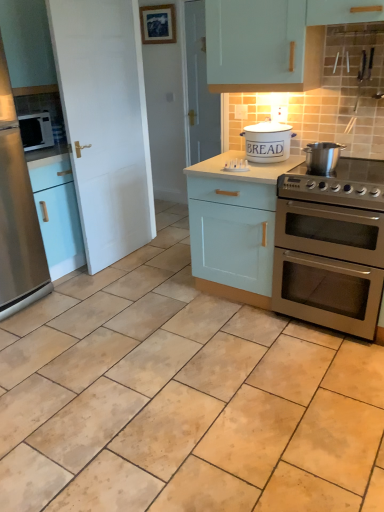
Find the location of `vacant space to the left of satin silver oven at right`. vacant space to the left of satin silver oven at right is located at coordinates (241, 334).